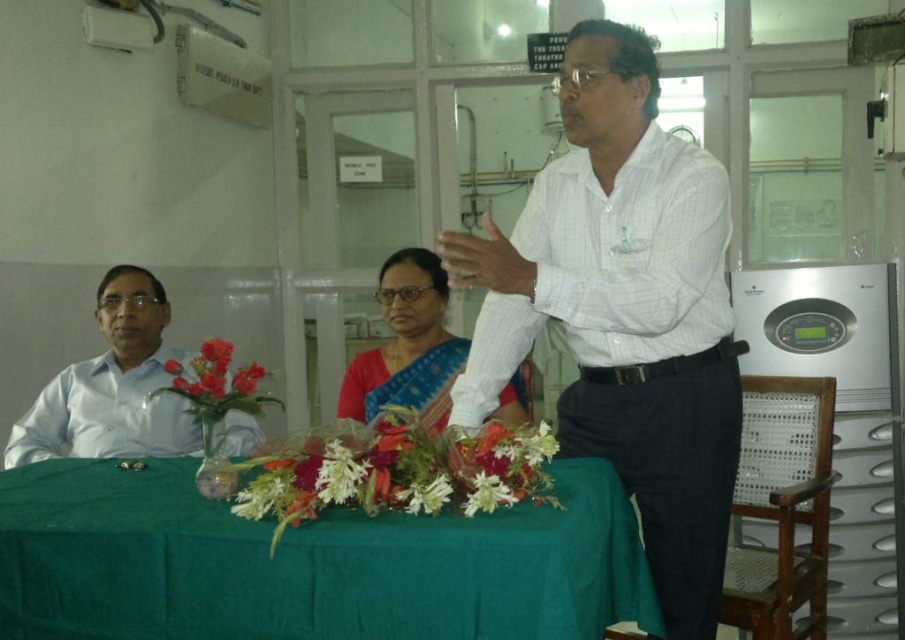
Between white checkered shirt at center and satin sari at center, which one has more height?

white checkered shirt at center

Image resolution: width=905 pixels, height=640 pixels. In order to click on white checkered shirt at center in this screenshot , I will do `click(624, 310)`.

Between white shirt at left and matte plastic flowers at left, which one is positioned lower?

white shirt at left is below.

Is white shirt at left above matte plastic flowers at left?

Incorrect, white shirt at left is not positioned above matte plastic flowers at left.

Between point (227, 419) and point (249, 392), which one is positioned in front?

Point (249, 392)

You are a GUI agent. You are given a task and a screenshot of the screen. Output one action in this format:
    pyautogui.click(x=<x>, y=<y>)
    Task: Click on the white shirt at left
    This screenshot has width=905, height=640.
    Given the screenshot: What is the action you would take?
    pyautogui.click(x=111, y=387)

Which is in front, point (389, 369) or point (198, 412)?

Positioned in front is point (198, 412).

Does satin sari at center have a smaller size compared to matte plastic flowers at left?

No.

Identify the location of satin sari at center. Image resolution: width=905 pixels, height=640 pixels. (405, 340).

Identify the location of satin sari at center. The image size is (905, 640). (405, 340).